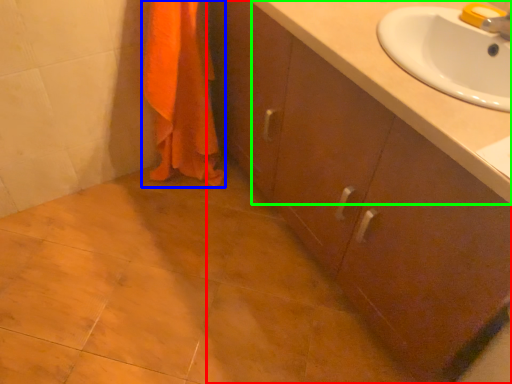
Question: Which object is positioned closest to bathroom cabinet (highlighted by a red box)? Select from bath towel (highlighted by a blue box) and counter top (highlighted by a green box).

Choices:
 (A) bath towel
 (B) counter top

Answer: (B)